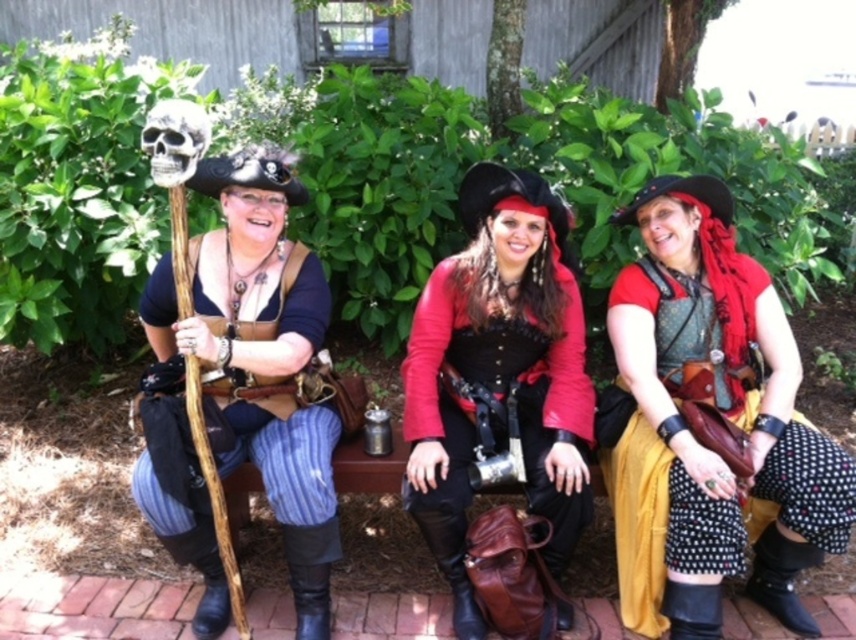
You are a painter standing in front of the three pirates on the wooden bench. You want to paint their staff and skull in the correct proportions. Which object should you paint taller, the matte brown leather staff at left or the gray matte skull at center?

The matte brown leather staff at left should be painted taller than the gray matte skull at center because the description states that the matte brown leather staff at left is much taller as gray matte skull at center.

You are a photographer trying to capture a clear shot of the gray matte skull at center and the shiny red fabric at center. Which object should you focus on first to ensure it appears sharp in the photo?

The shiny red fabric at center is closer to the viewer than the gray matte skull at center, so you should focus on the shiny red fabric at center first to ensure it appears sharp. If you focus on the gray matte skull at center, the shiny red fabric at center may appear blurry due to the difference in distance.

You are a photographer trying to capture a photo of the shiny red fabric at center and the gray matte skull at center. Based on their positions, which object should you focus on first if you want to include both in the frame without moving the camera?

The gray matte skull at center should be focused on first because it is to the left of the shiny red fabric at center, so adjusting the camera to include both would require ensuring the leftmost object is within the frame first.